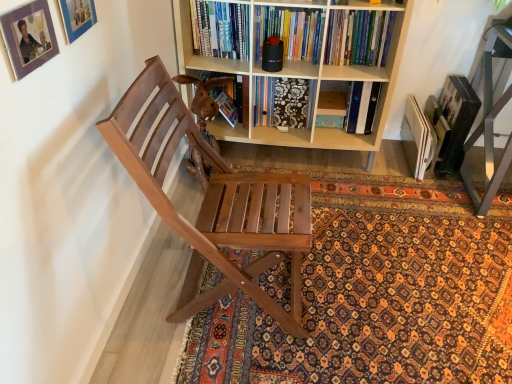
Question: Is the surface of matte blue picture frame at upper left, the 2th picture frame when ordered from front to back, in direct contact with patterned carpet at center?

Choices:
 (A) yes
 (B) no

Answer: (B)

Question: Considering the relative sizes of matte blue picture frame at upper left, the first picture frame when ordered from back to front, and patterned carpet at center in the image provided, is matte blue picture frame at upper left, the first picture frame when ordered from back to front, bigger than patterned carpet at center?

Choices:
 (A) yes
 (B) no

Answer: (B)

Question: Considering the relative sizes of matte blue picture frame at upper left, the first picture frame when ordered from back to front, and patterned carpet at center in the image provided, is matte blue picture frame at upper left, the first picture frame when ordered from back to front, wider than patterned carpet at center?

Choices:
 (A) no
 (B) yes

Answer: (A)

Question: Can you confirm if matte blue picture frame at upper left, the first picture frame when ordered from back to front, is smaller than patterned carpet at center?

Choices:
 (A) no
 (B) yes

Answer: (B)

Question: Is patterned carpet at center surrounded by matte blue picture frame at upper left, the 2th picture frame when ordered from front to back?

Choices:
 (A) no
 (B) yes

Answer: (A)

Question: From the image's perspective, is matte blue picture frame at upper left, the 2th picture frame when ordered from front to back, on top of patterned carpet at center?

Choices:
 (A) no
 (B) yes

Answer: (B)

Question: Does wooden chair at left have a lesser height compared to light wood bookcase at center?

Choices:
 (A) yes
 (B) no

Answer: (A)

Question: From the image's perspective, is wooden chair at left on light wood bookcase at center?

Choices:
 (A) yes
 (B) no

Answer: (B)

Question: Can you confirm if wooden chair at left is taller than light wood bookcase at center?

Choices:
 (A) no
 (B) yes

Answer: (A)

Question: Considering the relative sizes of wooden chair at left and light wood bookcase at center in the image provided, is wooden chair at left wider than light wood bookcase at center?

Choices:
 (A) yes
 (B) no

Answer: (A)

Question: From a real-world perspective, is wooden chair at left positioned under light wood bookcase at center based on gravity?

Choices:
 (A) no
 (B) yes

Answer: (B)

Question: Can you confirm if wooden chair at left is positioned to the left of light wood bookcase at center?

Choices:
 (A) yes
 (B) no

Answer: (A)

Question: Is hardcover book at upper center to the left of matte blue picture frame at upper left, the first picture frame when ordered from back to front, from the viewer's perspective?

Choices:
 (A) no
 (B) yes

Answer: (A)